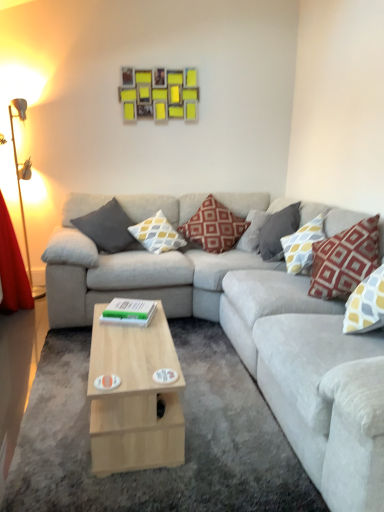
Where is `dark gray fabric pillow at left, the 1th pillow from the left`? This screenshot has width=384, height=512. dark gray fabric pillow at left, the 1th pillow from the left is located at coordinates (108, 228).

The height and width of the screenshot is (512, 384). What do you see at coordinates (251, 345) in the screenshot?
I see `light gray fabric couch at center` at bounding box center [251, 345].

Where is `red textured pillow at right, which ranks as the first pillow in right-to-left order`? The height and width of the screenshot is (512, 384). red textured pillow at right, which ranks as the first pillow in right-to-left order is located at coordinates (x=345, y=259).

The height and width of the screenshot is (512, 384). What do you see at coordinates (20, 186) in the screenshot?
I see `metallic gold table lamp at left` at bounding box center [20, 186].

You are a GUI agent. You are given a task and a screenshot of the screen. Output one action in this format:
    pyautogui.click(x=<x>, y=<y>)
    Task: Click on the red fabric pillow at center, the third pillow when ordered from left to right
    This screenshot has width=384, height=512.
    Given the screenshot: What is the action you would take?
    pyautogui.click(x=213, y=227)

Considering the relative sizes of red textured pillow at right, the 6th pillow positioned from the left, and dark gray fabric pillow at left, the 1th pillow from the left, in the image provided, is red textured pillow at right, the 6th pillow positioned from the left, smaller than dark gray fabric pillow at left, the 1th pillow from the left,?

No, red textured pillow at right, the 6th pillow positioned from the left, is not smaller than dark gray fabric pillow at left, the 1th pillow from the left.

Can you confirm if red textured pillow at right, which ranks as the first pillow in right-to-left order, is wider than dark gray fabric pillow at left, acting as the 6th pillow starting from the right?

Correct, the width of red textured pillow at right, which ranks as the first pillow in right-to-left order, exceeds that of dark gray fabric pillow at left, acting as the 6th pillow starting from the right.

Is red textured pillow at right, which ranks as the first pillow in right-to-left order, taller than dark gray fabric pillow at left, acting as the 6th pillow starting from the right?

Correct, red textured pillow at right, which ranks as the first pillow in right-to-left order, is much taller as dark gray fabric pillow at left, acting as the 6th pillow starting from the right.

Which point is more distant from viewer, (340,238) or (109,214)?

The point (109,214) is farther from the camera.

Would you say gray fabric pillow at upper right, the fourth pillow viewed from the left, contains light gray fabric couch at center?

Definitely not — light gray fabric couch at center is not inside gray fabric pillow at upper right, the fourth pillow viewed from the left.

There is a light gray fabric couch at center. Where is `the 3rd pillow above it (from the image's perspective)`? The width and height of the screenshot is (384, 512). the 3rd pillow above it (from the image's perspective) is located at coordinates (278, 231).

Does point (286, 209) appear closer or farther from the camera than point (382, 470)?

Point (286, 209) appears to be farther away from the viewer than point (382, 470).

Considering the relative sizes of gray fabric pillow at upper right, positioned as the third pillow in right-to-left order, and light gray fabric couch at center in the image provided, is gray fabric pillow at upper right, positioned as the third pillow in right-to-left order, wider than light gray fabric couch at center?

Incorrect, the width of gray fabric pillow at upper right, positioned as the third pillow in right-to-left order, does not surpass that of light gray fabric couch at center.

The image size is (384, 512). In order to click on pillow that is the 3rd one when counting rightward from the light gray fabric couch at center in this screenshot , I will do `click(302, 245)`.

Is point (299, 240) positioned before point (368, 447)?

No.

Does yellow and gray patterned pillow at right, the 2th pillow in the right-to-left sequence, have a greater width compared to light gray fabric couch at center?

In fact, yellow and gray patterned pillow at right, the 2th pillow in the right-to-left sequence, might be narrower than light gray fabric couch at center.

From a real-world perspective, who is located higher, light gray fabric couch at center or light wood/wooden coffee table at center?

light gray fabric couch at center.

Who is shorter, light gray fabric couch at center or light wood/wooden coffee table at center?

Standing shorter between the two is light wood/wooden coffee table at center.

Consider the image. Which is nearer, (276, 270) or (98, 467)?

Point (276, 270) appears to be farther away from the viewer than point (98, 467).

Is red fabric pillow at center, the third pillow when ordered from left to right, spatially inside light wood/wooden coffee table at center, or outside of it?

red fabric pillow at center, the third pillow when ordered from left to right, exists outside the volume of light wood/wooden coffee table at center.

Considering the sizes of objects red fabric pillow at center, which ranks as the fourth pillow in right-to-left order, and light wood/wooden coffee table at center in the image provided, who is thinner, red fabric pillow at center, which ranks as the fourth pillow in right-to-left order, or light wood/wooden coffee table at center?

light wood/wooden coffee table at center is thinner.

Considering the positions of objects red fabric pillow at center, which ranks as the fourth pillow in right-to-left order, and light wood/wooden coffee table at center in the image provided, who is more to the right, red fabric pillow at center, which ranks as the fourth pillow in right-to-left order, or light wood/wooden coffee table at center?

Positioned to the right is red fabric pillow at center, which ranks as the fourth pillow in right-to-left order.

Does red fabric pillow at center, the third pillow when ordered from left to right, turn towards light wood/wooden coffee table at center?

Yes, red fabric pillow at center, the third pillow when ordered from left to right, faces towards light wood/wooden coffee table at center.

From the image's perspective, does light gray fabric couch at center appear higher than red textured pillow at right, which ranks as the first pillow in right-to-left order?

No, from the image's perspective, light gray fabric couch at center is not above red textured pillow at right, which ranks as the first pillow in right-to-left order.

Between light gray fabric couch at center and red textured pillow at right, which ranks as the first pillow in right-to-left order, which one has more height?

light gray fabric couch at center is taller.

Which is in front, light gray fabric couch at center or red textured pillow at right, the 6th pillow positioned from the left?

Positioned in front is light gray fabric couch at center.

Considering the relative positions of red textured pillow at right, which ranks as the first pillow in right-to-left order, and green matte book at center in the image provided, is red textured pillow at right, which ranks as the first pillow in right-to-left order, to the right of green matte book at center from the viewer's perspective?

Indeed, red textured pillow at right, which ranks as the first pillow in right-to-left order, is positioned on the right side of green matte book at center.

From a real-world perspective, who is located higher, red textured pillow at right, which ranks as the first pillow in right-to-left order, or green matte book at center?

red textured pillow at right, which ranks as the first pillow in right-to-left order, is physically above.

Starting from the dark gray fabric pillow at left, acting as the 6th pillow starting from the right, which pillow is the 5th one to the right? Please provide its 2D coordinates.

[(345, 259)]

Where is `the 3rd pillow behind the light gray fabric couch at center, starting your count from the anchor`? the 3rd pillow behind the light gray fabric couch at center, starting your count from the anchor is located at coordinates (278, 231).

Considering their positions, is light gray fabric couch at center positioned closer to dark gray fabric pillow at left, acting as the 6th pillow starting from the right, than yellow and gray patterned pillow at right, the 2th pillow in the right-to-left sequence?

light gray fabric couch at center.

Estimate the real-world distances between objects in this image. Which object is closer to light wood/wooden coffee table at center, metallic gold table lamp at left or gray fabric pillow at upper right, the fourth pillow viewed from the left?

The object closer to light wood/wooden coffee table at center is gray fabric pillow at upper right, the fourth pillow viewed from the left.

Based on their spatial positions, is red textured pillow at right, the 6th pillow positioned from the left, or red fabric pillow at center, the third pillow when ordered from left to right, closer to dark gray fabric pillow at left, the 1th pillow from the left?

The object closer to dark gray fabric pillow at left, the 1th pillow from the left, is red fabric pillow at center, the third pillow when ordered from left to right.

Looking at the image, which one is located further to red fabric pillow at center, the third pillow when ordered from left to right, yellow and gray patterned pillow at right, acting as the 5th pillow starting from the left, or gray fabric pillow at upper right, positioned as the third pillow in right-to-left order?

yellow and gray patterned pillow at right, acting as the 5th pillow starting from the left, is further to red fabric pillow at center, the third pillow when ordered from left to right.

From the image, which object appears to be farther from red textured pillow at right, which ranks as the first pillow in right-to-left order, light gray fabric couch at center or green matte book at center?

Based on the image, green matte book at center appears to be further to red textured pillow at right, which ranks as the first pillow in right-to-left order.

Estimate the real-world distances between objects in this image. Which object is closer to red fabric pillow at center, the third pillow when ordered from left to right, metallic gold table lamp at left or yellow and gray patterned pillow at center, positioned as the 5th pillow in right-to-left order?

Based on the image, yellow and gray patterned pillow at center, positioned as the 5th pillow in right-to-left order, appears to be nearer to red fabric pillow at center, the third pillow when ordered from left to right.

Looking at the image, which one is located further to light wood/wooden coffee table at center, light gray fabric couch at center or gray fabric pillow at upper right, positioned as the third pillow in right-to-left order?

gray fabric pillow at upper right, positioned as the third pillow in right-to-left order.

From the image, which object appears to be farther from dark gray fabric pillow at left, acting as the 6th pillow starting from the right, red textured pillow at right, which ranks as the first pillow in right-to-left order, or green matte book at center?

red textured pillow at right, which ranks as the first pillow in right-to-left order.

You are a GUI agent. You are given a task and a screenshot of the screen. Output one action in this format:
    pyautogui.click(x=<x>, y=<y>)
    Task: Click on the coffee table between metallic gold table lamp at left and yellow and gray patterned pillow at right, the 2th pillow in the right-to-left sequence
    Image resolution: width=384 pixels, height=512 pixels.
    Given the screenshot: What is the action you would take?
    pyautogui.click(x=134, y=398)

Find the location of a particular element. This screenshot has height=512, width=384. book between light gray fabric couch at center and red fabric pillow at center, which ranks as the fourth pillow in right-to-left order, from front to back is located at coordinates (129, 312).

This screenshot has width=384, height=512. In order to click on book between metallic gold table lamp at left and red textured pillow at right, the 6th pillow positioned from the left, from left to right in this screenshot , I will do `click(129, 312)`.

Where is `table lamp between light gray fabric couch at center and red fabric pillow at center, which ranks as the fourth pillow in right-to-left order, from front to back`? table lamp between light gray fabric couch at center and red fabric pillow at center, which ranks as the fourth pillow in right-to-left order, from front to back is located at coordinates (20, 186).